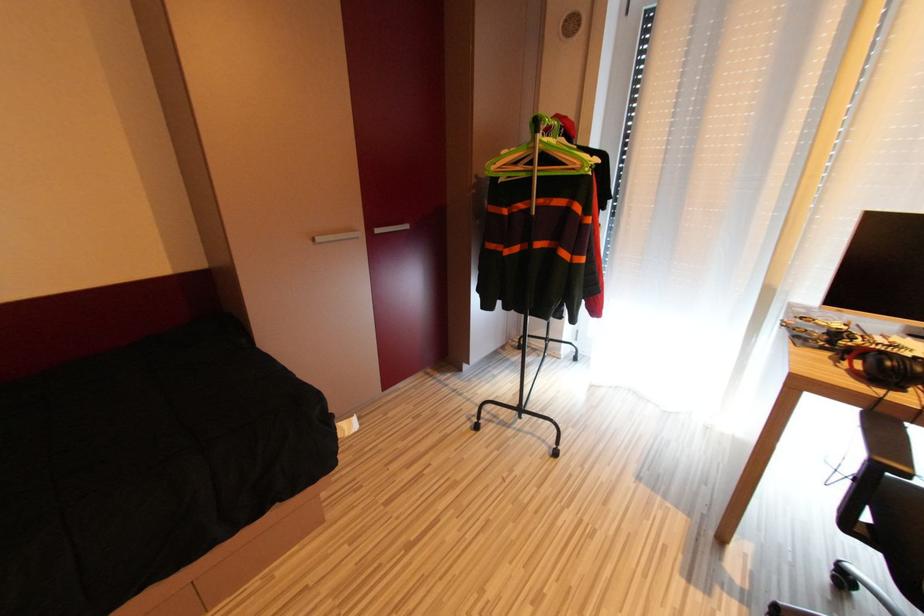
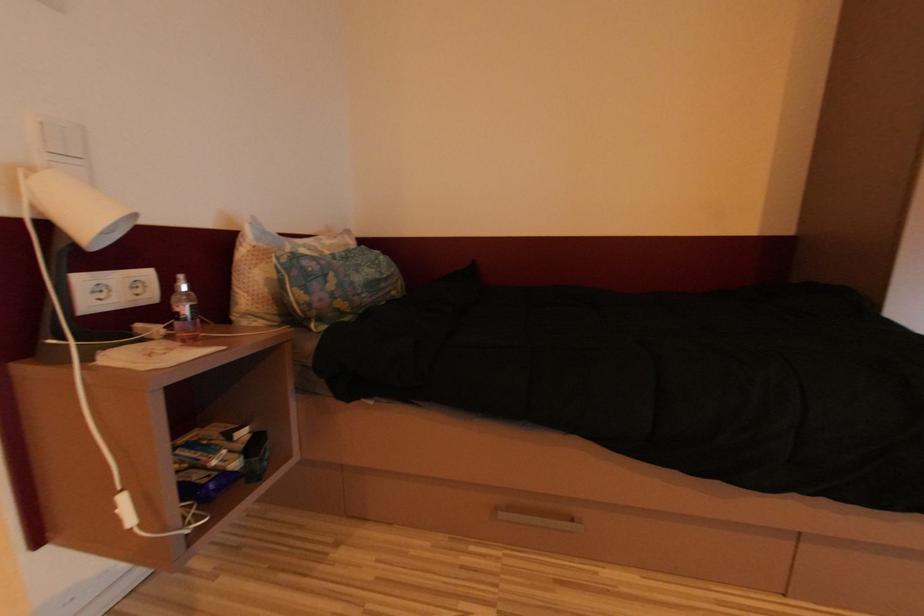
Question: The first image is from the beginning of the video and the second image is from the end. How did the camera likely rotate when shooting the video?

Choices:
 (A) Left
 (B) Right
 (C) Up
 (D) Down

Answer: (A)